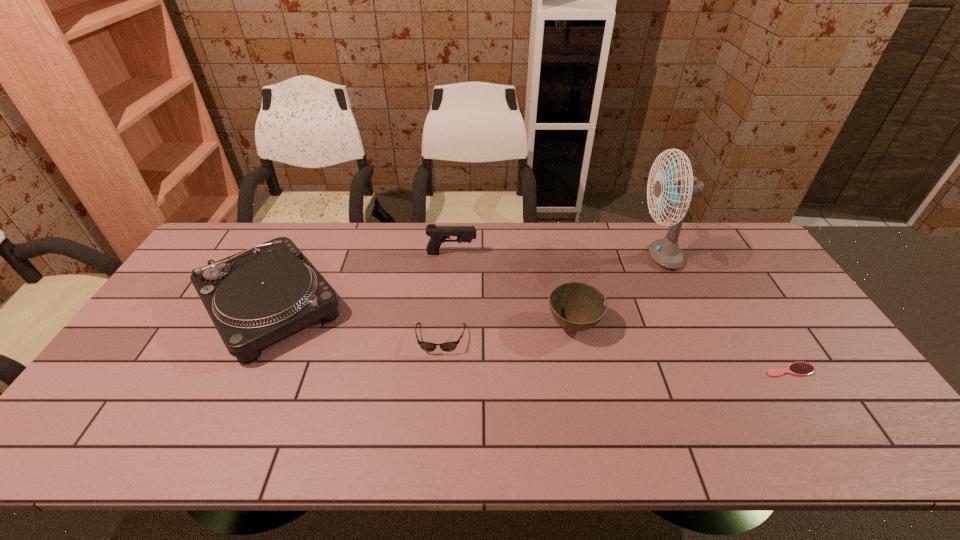
Where is `object that is at the right edge`? The image size is (960, 540). object that is at the right edge is located at coordinates (797, 368).

The width and height of the screenshot is (960, 540). I want to click on object that is at the far left corner, so click(x=254, y=298).

In the image, there is a desktop. In order to click on vacant area at the far edge in this screenshot , I will do `click(644, 260)`.

Identify the location of free region at the near edge of the desktop. This screenshot has height=540, width=960. (237, 422).

In the image, there is a desktop. At what (x,y) coordinates should I click in order to perform the action: click on vacant space at the left edge. Please return your answer as a coordinate pair (x, y). The image size is (960, 540). Looking at the image, I should click on (204, 316).

Locate an element on the screen. free space at the right edge of the desktop is located at coordinates (829, 390).

Locate an element on the screen. The height and width of the screenshot is (540, 960). free space at the far left corner of the desktop is located at coordinates (221, 230).

You are a GUI agent. You are given a task and a screenshot of the screen. Output one action in this format:
    pyautogui.click(x=<x>, y=<y>)
    Task: Click on the free space between the rightmost object and the second shortest object
    
    Given the screenshot: What is the action you would take?
    tap(615, 354)

Find the location of a particular element. The image size is (960, 540). vacant point located between the pistol and the sunglasses is located at coordinates (446, 296).

This screenshot has height=540, width=960. I want to click on vacant area between the sunglasses and the bowl, so click(x=507, y=333).